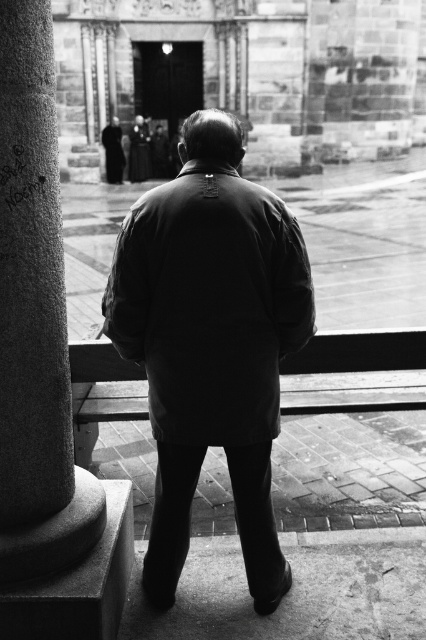
Question: Which point is farther to the camera?

Choices:
 (A) granite column at left
 (B) matte black jacket at center

Answer: (B)

Question: Does granite column at left appear under matte black jacket at center?

Choices:
 (A) yes
 (B) no

Answer: (A)

Question: Where is granite column at left located in relation to matte black jacket at center in the image?

Choices:
 (A) below
 (B) above

Answer: (A)

Question: Does granite column at left have a smaller size compared to matte black jacket at center?

Choices:
 (A) yes
 (B) no

Answer: (B)